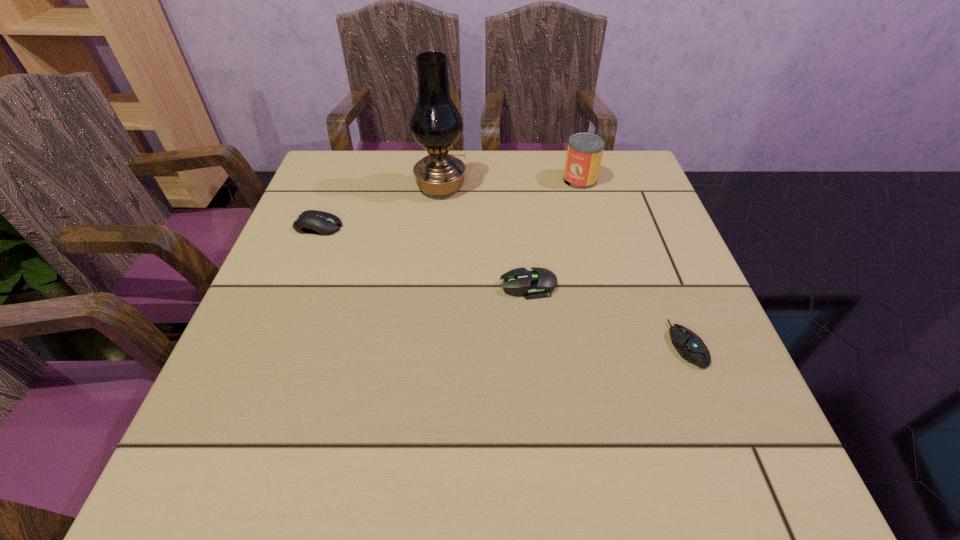
This screenshot has width=960, height=540. I want to click on computer mouse that can be found as the closest to the nearest computer mouse, so click(x=538, y=283).

Where is `computer mouse that is the second nearest to the second nearest computer mouse`? computer mouse that is the second nearest to the second nearest computer mouse is located at coordinates (316, 222).

The width and height of the screenshot is (960, 540). I want to click on free space that satisfies the following two spatial constraints: 1. on the front side of the second farthest computer mouse; 2. on the right side of the nearest object, so tap(534, 345).